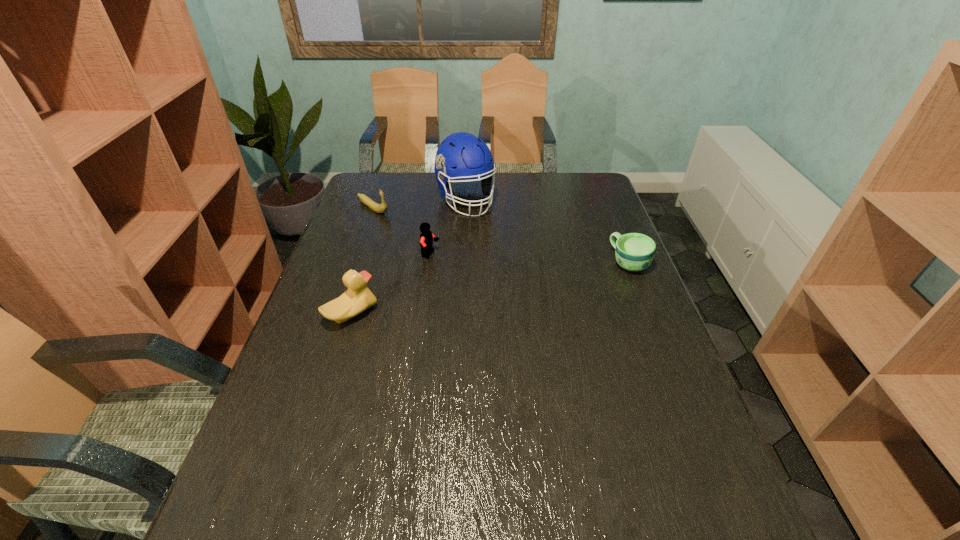
The height and width of the screenshot is (540, 960). What are the coordinates of `vacant space on the desktop that is between the nearest object and the rightmost object and is positioned at the stem of the banana` in the screenshot? It's located at (498, 287).

At what (x,y) coordinates should I click in order to perform the action: click on vacant space on the desktop that is between the nearest object and the shortest object and is positioned on the front-facing side of the Lego. Please return your answer as a coordinate pair (x, y). The image size is (960, 540). Looking at the image, I should click on (510, 285).

Image resolution: width=960 pixels, height=540 pixels. I want to click on free space on the desktop that is between the nearest object and the rightmost object and is positioned on the front-facing side of the tallest object, so click(x=527, y=281).